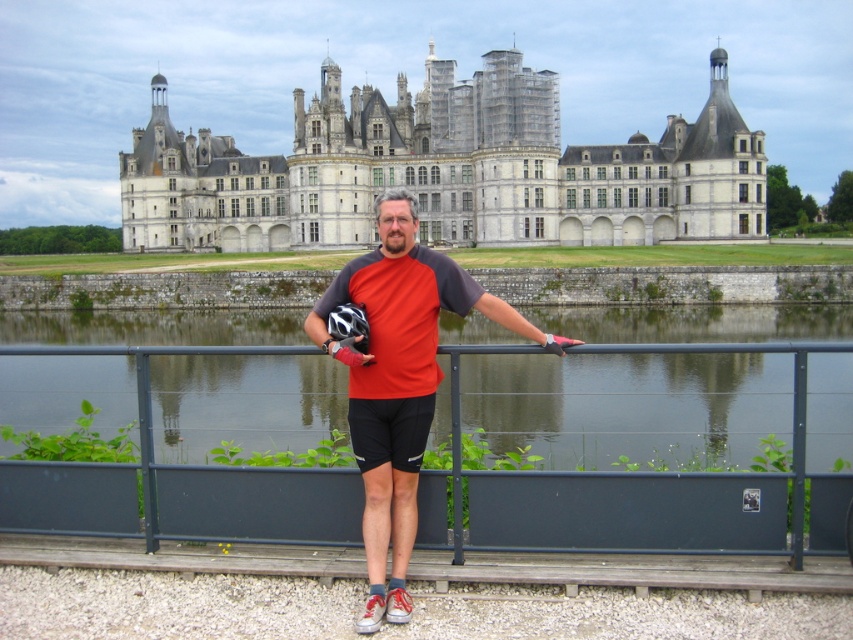
Consider the image. You are a photographer trying to capture the person in the matte red shirt at center while ensuring the castle is visible in the background. Based on their current position, can you determine if the person is close enough to the railing to include both the castle and the person in the frame?

The matte red shirt at center is located at point (397, 381), which means the person is positioned near the railing overlooking the moat. Since the castle is in the background and the person is close to the edge, both the person and the castle should be visible in the frame when taking the photo from this vantage point.

You are standing in front of the castle and want to take a photo. There are two points marked in the image. Which point is closer to you, point (329,76) or point (544,340)?

Point (329,76) is closer to you because it is further to the viewer than point (544,340).